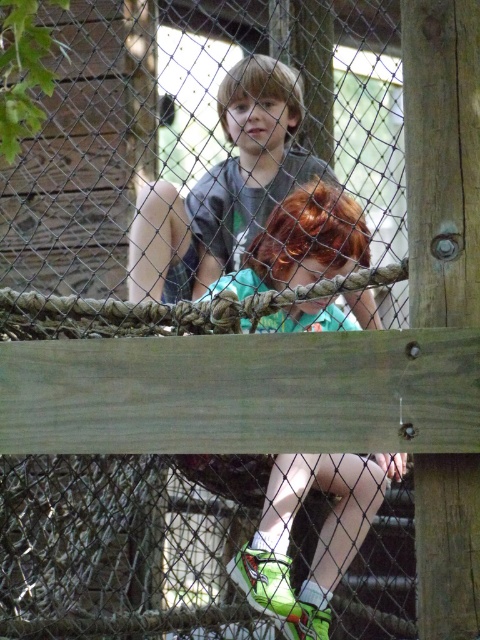
You are a photographer trying to capture both the green fabric shirt at center and the matte gray shirt at center in a single shot. Since you want to ensure both are in focus, which shirt should you adjust your camera focus on first?

You should focus on the green fabric shirt at center first because it is closer to the viewer than the matte gray shirt at center, so adjusting focus starting from the closer object ensures both are in focus.

You are a tailor measuring shirts for a customer. You have two shirts in front of you, the green fabric shirt at center and the matte gray shirt at center. The customer wants to know which shirt is narrower. Which one should you recommend?

The green fabric shirt at center is narrower than the matte gray shirt at center, so you should recommend the green fabric shirt at center.

You are a photographer trying to capture both the green fabric shirt at center and the matte gray shirt at center in a single shot. Given that the camera has a limited focus area, which shirt should you prioritize to ensure it takes up more of the frame?

The matte gray shirt at center occupies more space than the green fabric shirt at center, so prioritizing the matte gray shirt at center would ensure it takes up more of the frame.